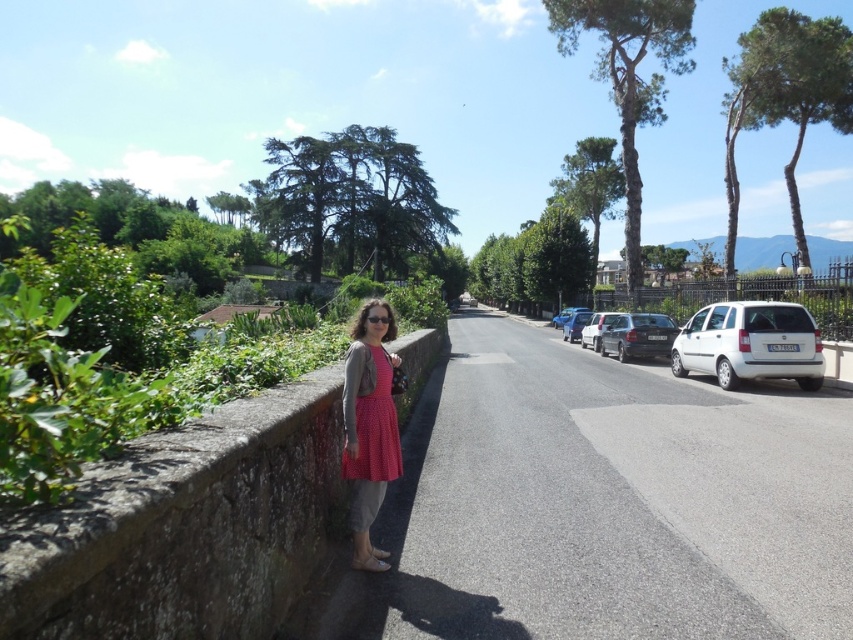
Question: Does rustic stone ledge at center left have a lesser width compared to shiny black car at center-right?

Choices:
 (A) yes
 (B) no

Answer: (A)

Question: Does white matte van at right have a greater width compared to white metallic car at center-right?

Choices:
 (A) yes
 (B) no

Answer: (A)

Question: Is metallic silver car at center-right to the left of metallic silver car at center from the viewer's perspective?

Choices:
 (A) yes
 (B) no

Answer: (A)

Question: Which of the following is the farthest from the observer?

Choices:
 (A) white matte van at right
 (B) metallic silver car at center-right

Answer: (B)

Question: Which object is the farthest from the metallic silver car at center?

Choices:
 (A) white metallic car at center-right
 (B) polka dot dress at center

Answer: (B)

Question: Which point is farther to the camera?

Choices:
 (A) (136, 451)
 (B) (780, 328)
 (C) (570, 321)
 (D) (378, 416)

Answer: (C)